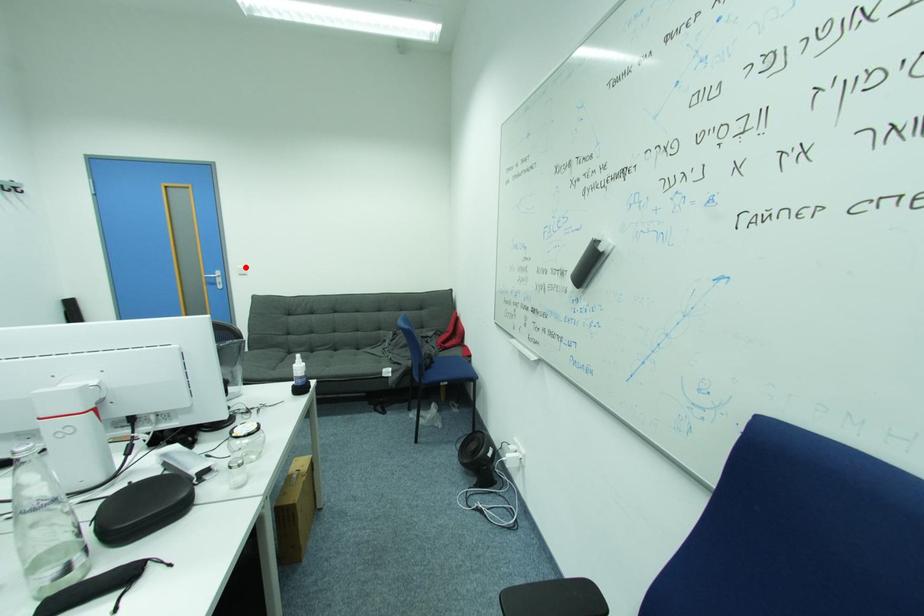
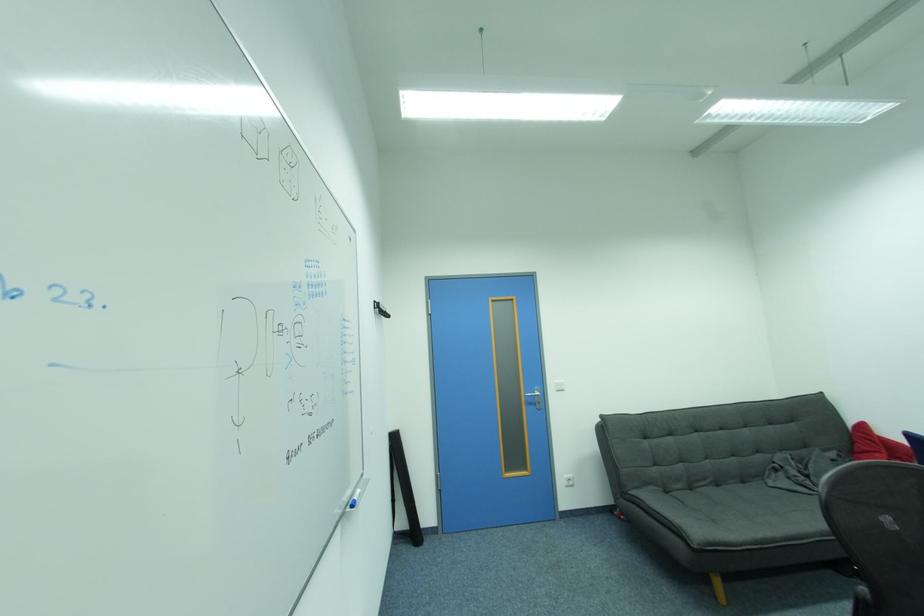
In the second image, find the point that corresponds to the highlighted location in the first image.

(564, 382)